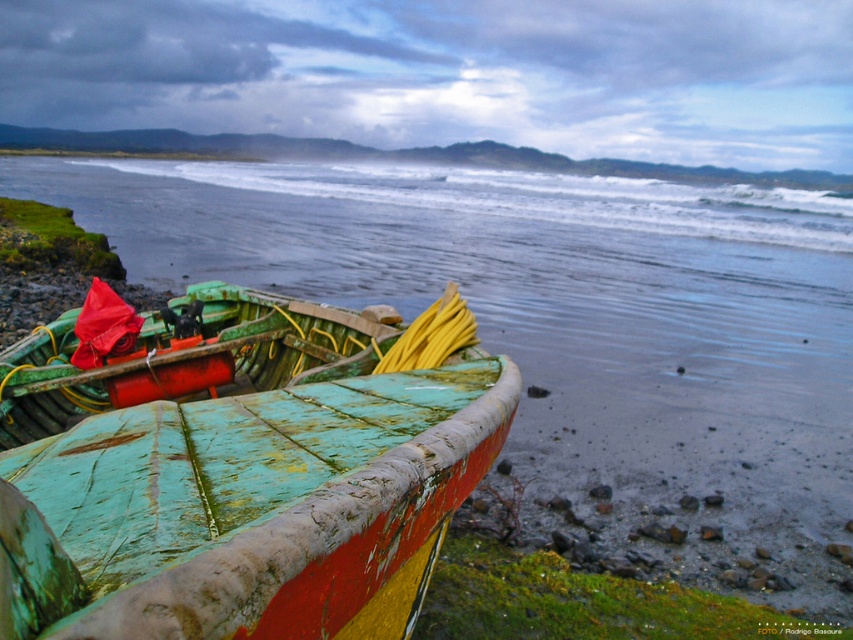
Question: Which point is closer to the camera?

Choices:
 (A) green weathered wood boat at lower left
 (B) greenish-blue water at lower left

Answer: (A)

Question: Which object appears farthest from the camera in this image?

Choices:
 (A) green weathered wood boat at lower left
 (B) greenish-blue water at lower left

Answer: (B)

Question: Is greenish-blue water at lower left below green weathered wood boat at lower left?

Choices:
 (A) no
 (B) yes

Answer: (A)

Question: Which point is closer to the camera?

Choices:
 (A) (653, 296)
 (B) (309, 317)

Answer: (B)

Question: Is greenish-blue water at lower left closer to the viewer compared to green weathered wood boat at lower left?

Choices:
 (A) yes
 (B) no

Answer: (B)

Question: Is greenish-blue water at lower left smaller than green weathered wood boat at lower left?

Choices:
 (A) no
 (B) yes

Answer: (A)